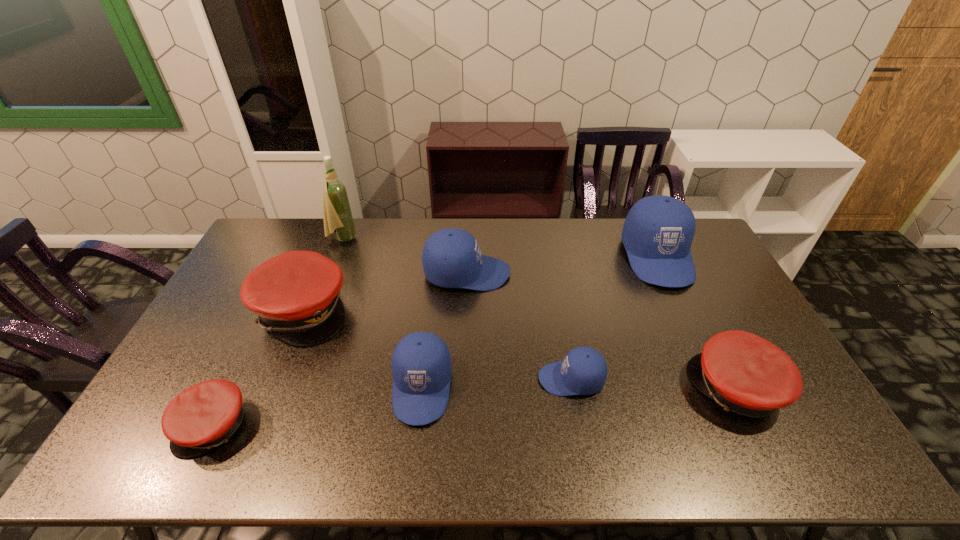
I want to click on the shortest object, so click(205, 415).

Identify the location of the shortest cap. Image resolution: width=960 pixels, height=540 pixels. click(x=205, y=415).

The image size is (960, 540). What are the coordinates of `free region located 0.350m on the front-facing side of the tallest object` in the screenshot? It's located at (448, 239).

Where is `vacant area located on the front-facing side of the rightmost blue cap`? This screenshot has width=960, height=540. vacant area located on the front-facing side of the rightmost blue cap is located at coordinates (688, 322).

The height and width of the screenshot is (540, 960). Identify the location of blank space located 0.050m on the front-facing side of the third tallest object. (524, 273).

You are a GUI agent. You are given a task and a screenshot of the screen. Output one action in this format:
    pyautogui.click(x=<x>, y=<y>)
    Task: Click on the vacant point located 0.140m at the front of the farthest red cap where the visor is located
    The height and width of the screenshot is (540, 960).
    Given the screenshot: What is the action you would take?
    pyautogui.click(x=393, y=311)

You are a GUI agent. You are given a task and a screenshot of the screen. Output one action in this format:
    pyautogui.click(x=<x>, y=<y>)
    Task: Click on the free space located 0.070m on the front-facing side of the second smallest blue cap
    Image resolution: width=960 pixels, height=540 pixels.
    Given the screenshot: What is the action you would take?
    pyautogui.click(x=414, y=455)

I want to click on blank space located 0.130m at the front of the second biggest red cap where the visor is located, so click(x=644, y=389).

You are a GUI agent. You are given a task and a screenshot of the screen. Output one action in this format:
    pyautogui.click(x=<x>, y=<y>)
    Task: Click on the vacant space situated at the front of the second biggest red cap where the visor is located
    
    Given the screenshot: What is the action you would take?
    pyautogui.click(x=560, y=389)

This screenshot has width=960, height=540. I want to click on free space located 0.280m at the front of the second biggest red cap where the visor is located, so click(x=588, y=389).